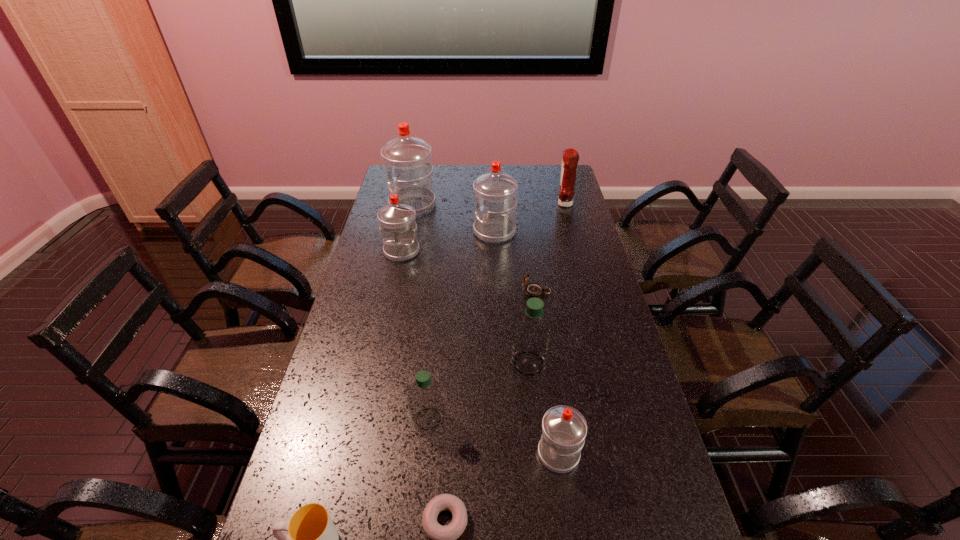
Where is `the fifth closest water bottle to the fourth farthest water bottle`? Image resolution: width=960 pixels, height=540 pixels. the fifth closest water bottle to the fourth farthest water bottle is located at coordinates (407, 157).

Point out which white water bottle is positioned as the third nearest to the nearest white water bottle. Please provide its 2D coordinates. Your answer should be formatted as a tuple, i.e. [(x, y)], where the tuple contains the x and y coordinates of a point satisfying the conditions above.

[(407, 157)]

The height and width of the screenshot is (540, 960). In order to click on white water bottle that is the third closest to the farthest water bottle in this screenshot , I will do `click(564, 429)`.

Where is `free point that satisfies the following two spatial constraints: 1. on the handle side of the farthest water bottle; 2. on the right side of the sixth farthest object`? This screenshot has width=960, height=540. free point that satisfies the following two spatial constraints: 1. on the handle side of the farthest water bottle; 2. on the right side of the sixth farthest object is located at coordinates (378, 363).

The height and width of the screenshot is (540, 960). I want to click on free space that satisfies the following two spatial constraints: 1. on the front side of the condiment; 2. on the handle side of the second biggest white water bottle, so click(572, 232).